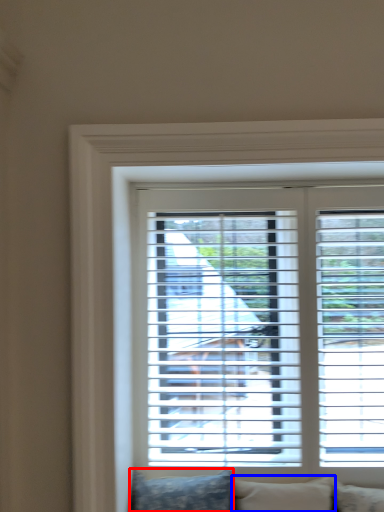
Question: Which of the following is the closest to the observer, pillow (highlighted by a red box) or pillow (highlighted by a blue box)?

Choices:
 (A) pillow
 (B) pillow

Answer: (A)